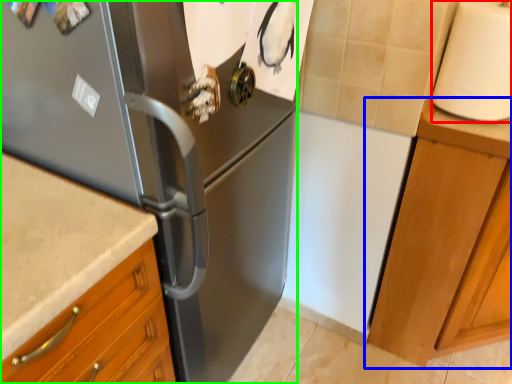
Question: Which object is the farthest from paper towel (highlighted by a red box)? Choose among these: cabinetry (highlighted by a blue box) or refrigerator (highlighted by a green box).

Choices:
 (A) cabinetry
 (B) refrigerator

Answer: (B)